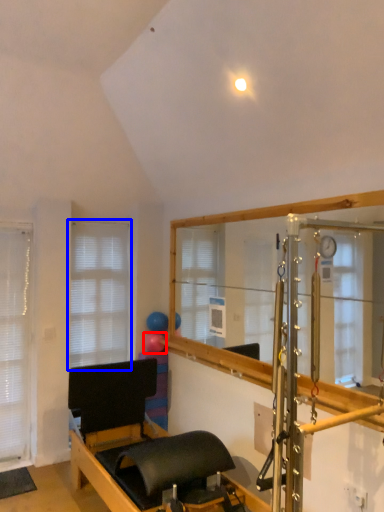
Question: Which of the following is the farthest to the observer, balloon (highlighted by a red box) or window (highlighted by a blue box)?

Choices:
 (A) balloon
 (B) window

Answer: (A)